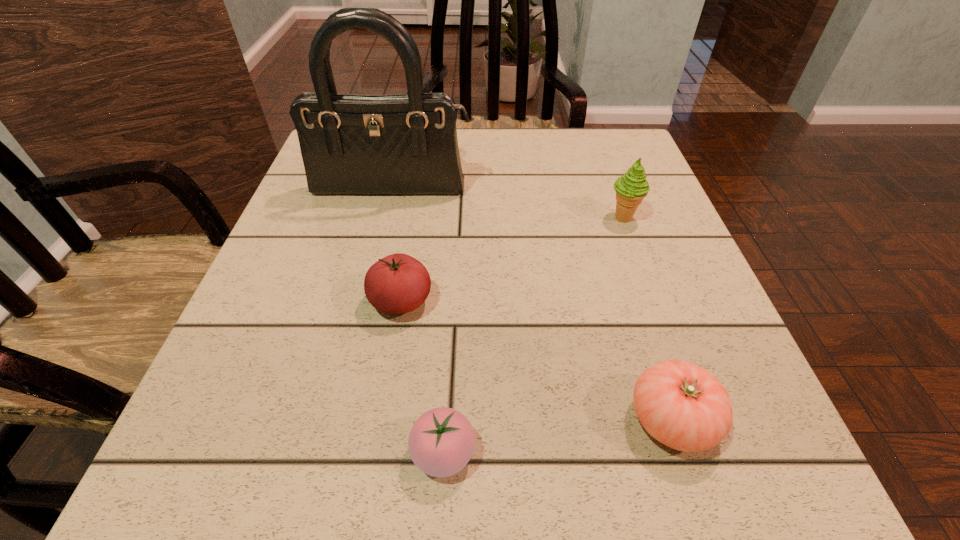
This screenshot has height=540, width=960. Find the location of `the tallest object`. the tallest object is located at coordinates (404, 144).

Image resolution: width=960 pixels, height=540 pixels. What are the coordinates of `the farthest object` in the screenshot? It's located at (404, 144).

The image size is (960, 540). I want to click on the second farthest object, so click(631, 188).

This screenshot has height=540, width=960. What are the coordinates of `icecream` in the screenshot? It's located at (631, 188).

Locate an element on the screen. Image resolution: width=960 pixels, height=540 pixels. the third nearest object is located at coordinates (398, 283).

Identify the location of the rightmost tomato. The image size is (960, 540). (682, 405).

Where is `the shortest tomato`? The image size is (960, 540). the shortest tomato is located at coordinates (441, 442).

You are a GUI agent. You are given a task and a screenshot of the screen. Output one action in this format:
    pyautogui.click(x=<x>, y=<y>)
    Task: Click on the vacant space located with an open clasp on the front of the farthest object
    Image resolution: width=960 pixels, height=540 pixels.
    Given the screenshot: What is the action you would take?
    pyautogui.click(x=360, y=322)

The width and height of the screenshot is (960, 540). What are the coordinates of `vacant space located 0.160m on the left of the fourth shortest object` in the screenshot? It's located at (527, 218).

Find the location of a particular element. vacant region located on the front of the third nearest object is located at coordinates (379, 436).